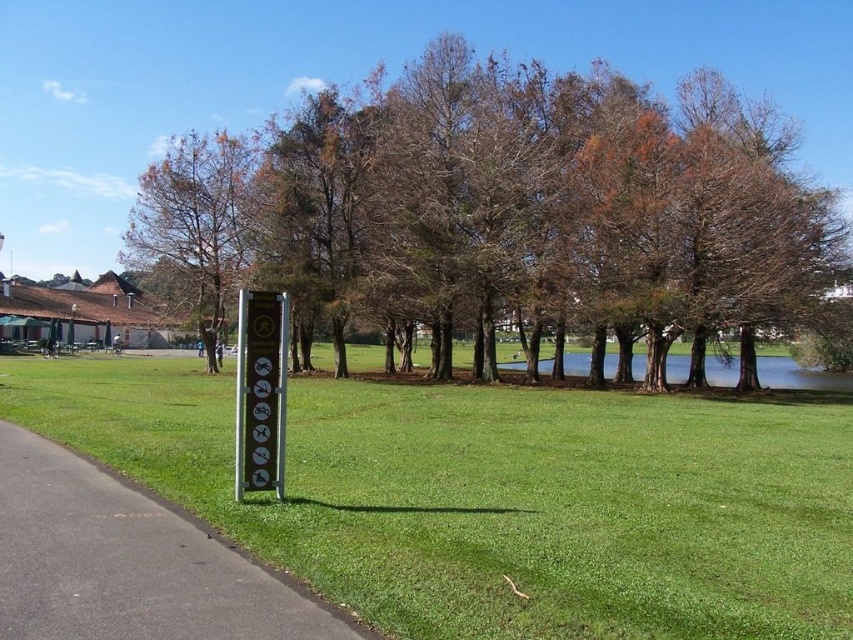
Question: Which object is farther from the camera taking this photo?

Choices:
 (A) brown/dried wood tree at center
 (B) black asphalt at lower left

Answer: (A)

Question: Is brown/dry wood trees at center to the right of metallic sign at center from the viewer's perspective?

Choices:
 (A) yes
 (B) no

Answer: (A)

Question: Can you confirm if metallic sign at center is positioned to the left of green grassy lake at center?

Choices:
 (A) no
 (B) yes

Answer: (B)

Question: Which point is farther from the camera taking this photo?

Choices:
 (A) (x=178, y=216)
 (B) (x=540, y=236)
 (C) (x=247, y=298)

Answer: (A)

Question: Considering the relative positions of green grassy at center and brown/dried wood tree at center in the image provided, where is green grassy at center located with respect to brown/dried wood tree at center?

Choices:
 (A) above
 (B) below

Answer: (B)

Question: Which point is farther to the camera?

Choices:
 (A) (786, 147)
 (B) (762, 356)

Answer: (B)